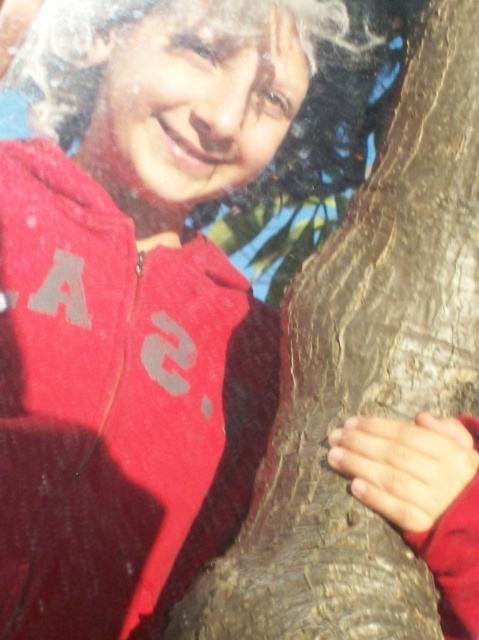
Question: Observing the image, what is the correct spatial positioning of matte red jacket at left in reference to curly blonde hair at upper left?

Choices:
 (A) right
 (B) left

Answer: (B)

Question: Is the position of matte red jacket at left more distant than that of curly blonde hair at upper left?

Choices:
 (A) no
 (B) yes

Answer: (A)

Question: Can you confirm if matte red jacket at left is positioned to the right of curly blonde hair at upper left?

Choices:
 (A) no
 (B) yes

Answer: (A)

Question: Which of the following is the farthest from the observer?

Choices:
 (A) (262, 19)
 (B) (148, 268)

Answer: (B)

Question: Which object appears farthest from the camera in this image?

Choices:
 (A) matte red jacket at left
 (B) curly blonde hair at upper left

Answer: (B)

Question: Which object is farther from the camera taking this photo?

Choices:
 (A) curly blonde hair at upper left
 (B) matte red jacket at left

Answer: (A)